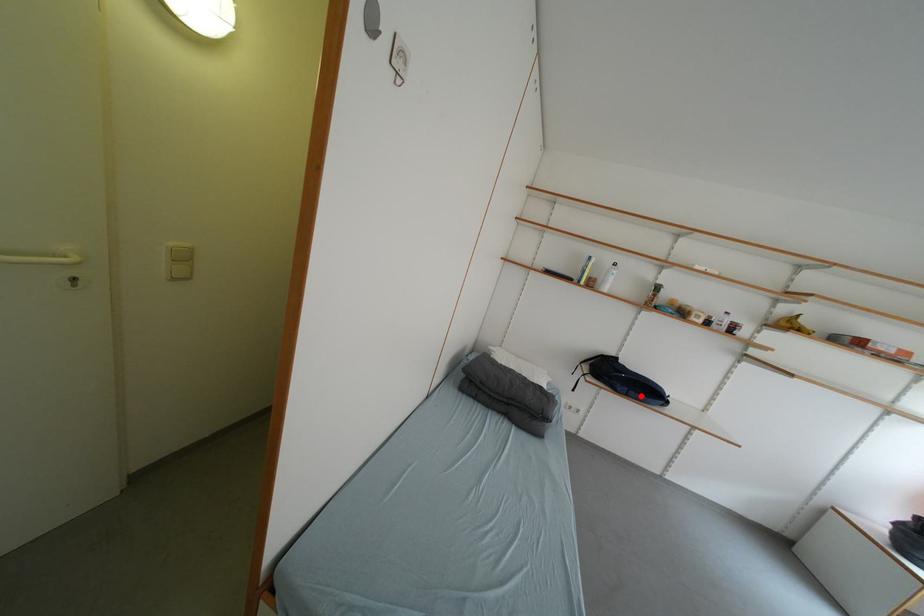
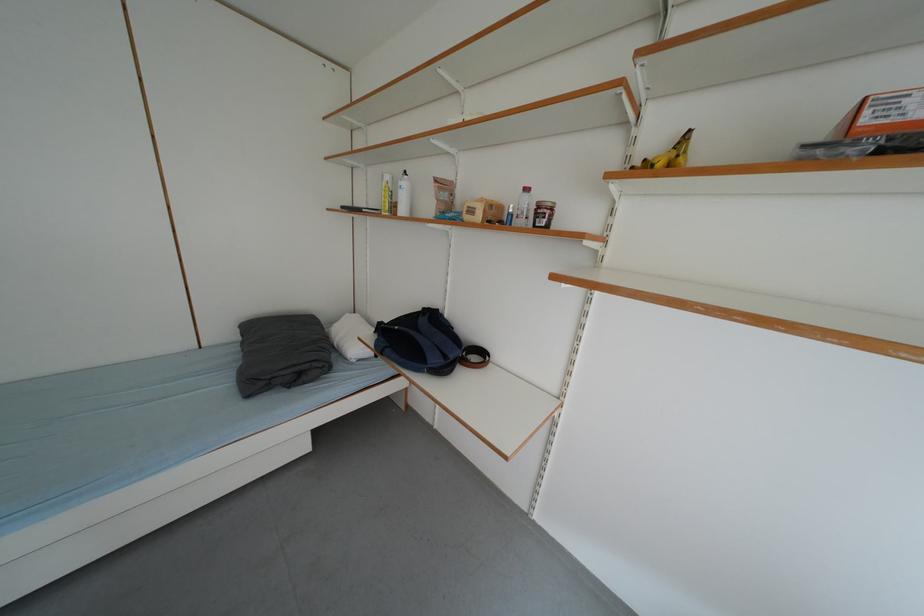
Where in the second image is the point corresponding to the highlighted location from the first image?

(396, 354)